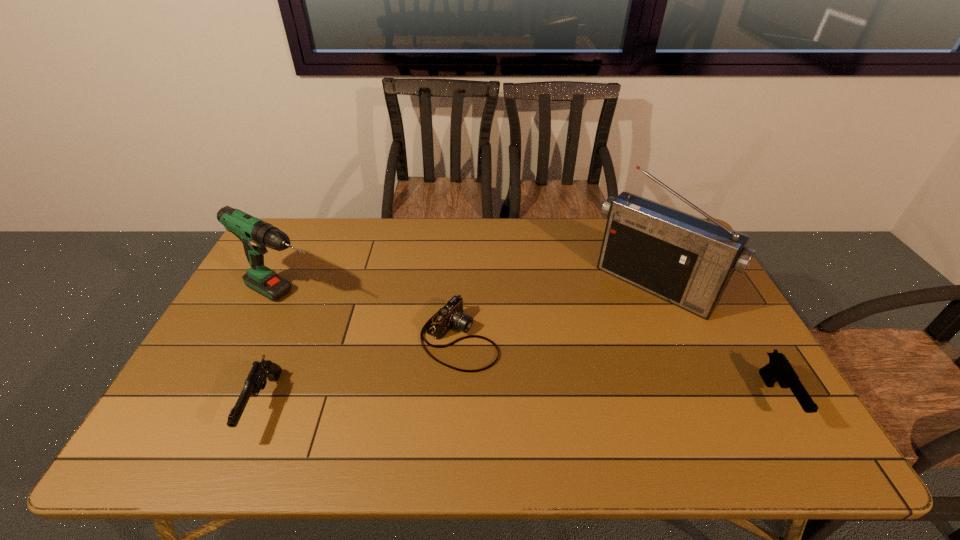
Select which object appears as the fourth closest to the shortest object. Please provide its 2D coordinates. Your answer should be formatted as a tuple, i.e. [(x, y)], where the tuple contains the x and y coordinates of a point satisfying the conditions above.

[(778, 369)]

The width and height of the screenshot is (960, 540). Identify the location of object that is the fourth nearest to the radio receiver. (257, 378).